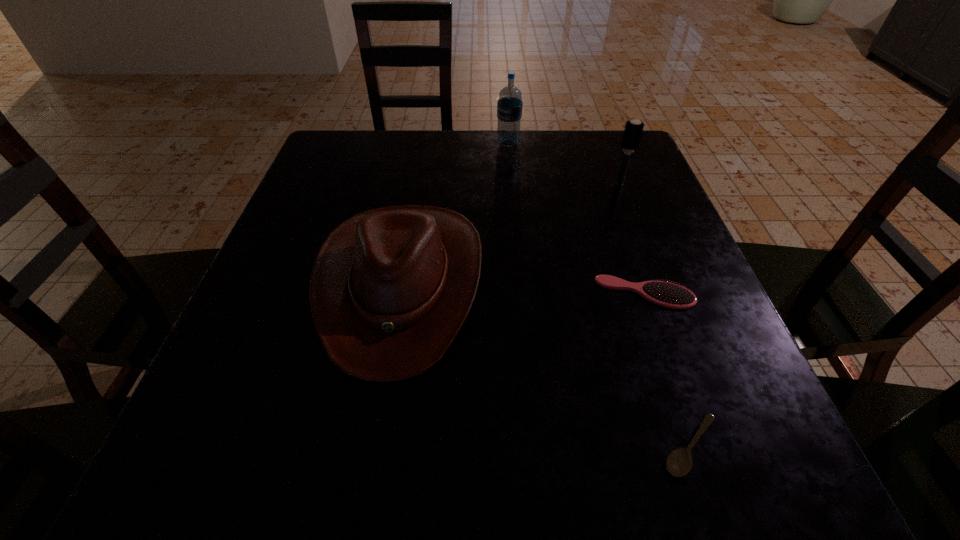
The width and height of the screenshot is (960, 540). In order to click on empty space between the leftmost object and the taller hairbrush in this screenshot , I will do `click(511, 234)`.

The height and width of the screenshot is (540, 960). Identify the location of vacant area that lies between the fourth shortest object and the nearest object. (655, 315).

The image size is (960, 540). In order to click on empty space that is in between the shortest object and the shorter hairbrush in this screenshot , I will do `click(667, 369)`.

At what (x,y) coordinates should I click in order to perform the action: click on free area in between the shorter hairbrush and the leftmost object. Please return your answer as a coordinate pair (x, y). The image size is (960, 540). Looking at the image, I should click on coord(523,288).

The height and width of the screenshot is (540, 960). What are the coordinates of `vacant region between the shorter hairbrush and the leftmost object` in the screenshot? It's located at (523, 288).

This screenshot has height=540, width=960. Identify the location of free space between the farthest object and the shorter hairbrush. (576, 218).

Find the location of a particular element. The height and width of the screenshot is (540, 960). object that is the closest one to the farthest object is located at coordinates (633, 130).

Identify which object is the closest to the cowboy hat. Please provide its 2D coordinates. Your answer should be formatted as a tuple, i.e. [(x, y)], where the tuple contains the x and y coordinates of a point satisfying the conditions above.

[(670, 295)]

Identify the location of vacant space that satisfies the following two spatial constraints: 1. on the front side of the water bottle; 2. on the right side of the farther hairbrush. This screenshot has width=960, height=540. (512, 184).

Locate an element on the screen. The image size is (960, 540). free location that satisfies the following two spatial constraints: 1. on the front-facing side of the shortest object; 2. on the left side of the cowboy hat is located at coordinates (373, 447).